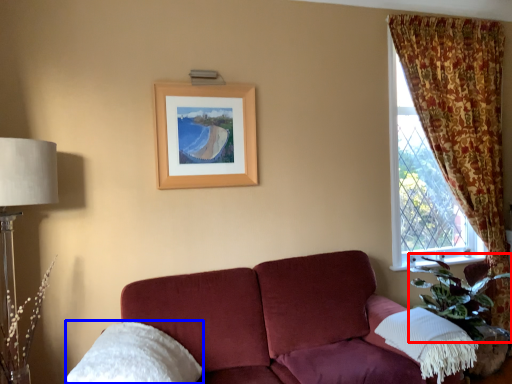
Question: Which of the following is the farthest to the observer, plant (highlighted by a red box) or pillow (highlighted by a blue box)?

Choices:
 (A) plant
 (B) pillow

Answer: (A)